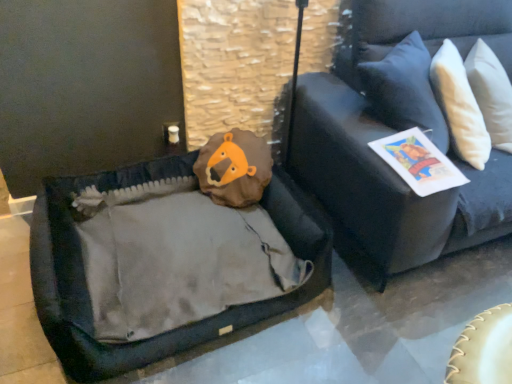
Question: Is white paper magazine at upper right to the left of velvet dark blue couch at upper right from the viewer's perspective?

Choices:
 (A) no
 (B) yes

Answer: (B)

Question: Is white paper magazine at upper right not inside velvet dark blue couch at upper right?

Choices:
 (A) yes
 (B) no

Answer: (B)

Question: From a real-world perspective, is white paper magazine at upper right physically above velvet dark blue couch at upper right?

Choices:
 (A) yes
 (B) no

Answer: (B)

Question: Is white paper magazine at upper right turned away from velvet dark blue couch at upper right?

Choices:
 (A) yes
 (B) no

Answer: (A)

Question: Is velvet dark blue couch at upper right located within white paper magazine at upper right?

Choices:
 (A) yes
 (B) no

Answer: (B)

Question: Is white paper magazine at upper right thinner than velvet dark blue couch at upper right?

Choices:
 (A) yes
 (B) no

Answer: (A)

Question: Is velvet dark blue couch at upper right at the left side of white paper magazine at upper right?

Choices:
 (A) yes
 (B) no

Answer: (B)

Question: Is velvet dark blue couch at upper right facing towards white paper magazine at upper right?

Choices:
 (A) no
 (B) yes

Answer: (A)

Question: Considering the relative sizes of velvet dark blue couch at upper right and white paper magazine at upper right in the image provided, is velvet dark blue couch at upper right shorter than white paper magazine at upper right?

Choices:
 (A) yes
 (B) no

Answer: (B)

Question: From the image's perspective, is velvet dark blue couch at upper right on top of white paper magazine at upper right?

Choices:
 (A) no
 (B) yes

Answer: (B)

Question: Considering the relative sizes of velvet dark blue couch at upper right and white paper magazine at upper right in the image provided, is velvet dark blue couch at upper right taller than white paper magazine at upper right?

Choices:
 (A) yes
 (B) no

Answer: (A)

Question: Does velvet dark blue couch at upper right appear on the right side of white paper magazine at upper right?

Choices:
 (A) no
 (B) yes

Answer: (B)

Question: Would you say white paper magazine at upper right is inside or outside velvet dark blue couch at upper right?

Choices:
 (A) inside
 (B) outside

Answer: (A)